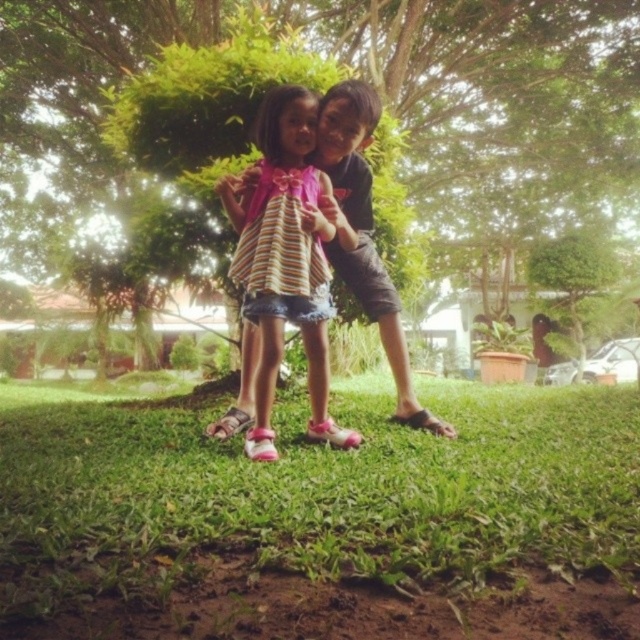
You are a GUI agent. You are given a task and a screenshot of the screen. Output one action in this format:
    pyautogui.click(x=<x>, y=<y>)
    Task: Click on the green grass at lower center
    
    Given the screenshot: What is the action you would take?
    pyautogui.click(x=323, y=518)

Who is lower down, green grass at lower center or green leafy tree at center?

green grass at lower center is lower down.

Between point (241, 596) and point (440, 152), which one is positioned behind?

Positioned behind is point (440, 152).

What are the coordinates of `green grass at lower center` in the screenshot? It's located at (323, 518).

Is point (422, 548) positioned before point (316, 282)?

Yes, it is.

Which is behind, point (518, 525) or point (292, 305)?

Positioned behind is point (292, 305).

Is point (296, 554) positioned before point (314, 317)?

That is True.

Where is `green grass at lower center`? The image size is (640, 640). green grass at lower center is located at coordinates (323, 518).

Who is positioned more to the left, green leafy tree at center or striped fabric dress at center?

green leafy tree at center is more to the left.

Can you confirm if green leafy tree at center is positioned to the left of striped fabric dress at center?

Indeed, green leafy tree at center is positioned on the left side of striped fabric dress at center.

Is point (490, 44) closer to camera compared to point (237, 284)?

No, (490, 44) is behind (237, 284).

At what (x,y) coordinates should I click in order to perform the action: click on green leafy tree at center. Please return your answer as a coordinate pair (x, y). The width and height of the screenshot is (640, 640). Looking at the image, I should click on (496, 93).